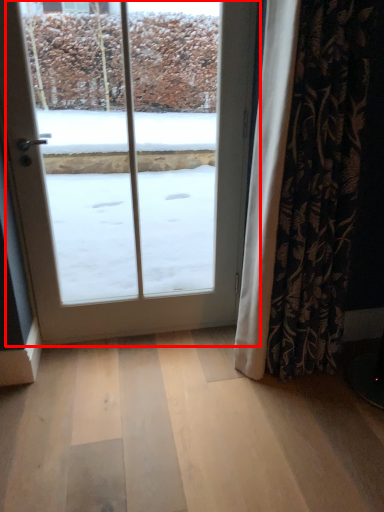
Question: From the image's perspective, where is door (annotated by the red box) located in relation to curtain in the image?

Choices:
 (A) below
 (B) above

Answer: (B)